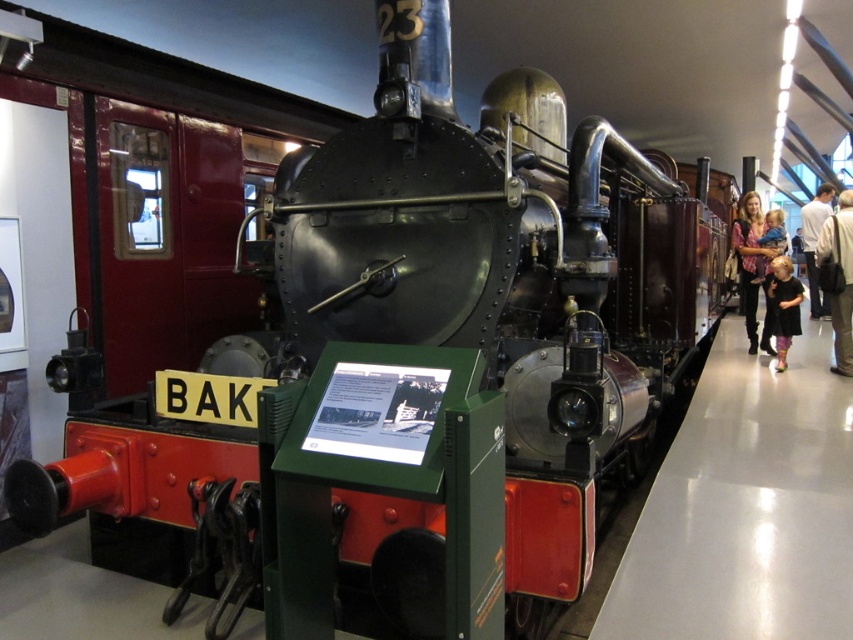
Which is more to the right, black leather jacket at right or light brown leather jacket at right?

Positioned to the right is light brown leather jacket at right.

Does black leather jacket at right appear on the left side of light brown leather jacket at right?

Indeed, black leather jacket at right is positioned on the left side of light brown leather jacket at right.

Where is `black leather jacket at right`? black leather jacket at right is located at coordinates 752,268.

What are the coordinates of `black leather jacket at right` in the screenshot? It's located at (752, 268).

Can you confirm if dark brown leather jacket at right is wider than light pink fabric at right?

No, dark brown leather jacket at right is not wider than light pink fabric at right.

Is the position of dark brown leather jacket at right more distant than that of light pink fabric at right?

No, it is not.

Which is behind, point (816, 262) or point (778, 241)?

The point (778, 241) is behind.

The width and height of the screenshot is (853, 640). I want to click on dark brown leather jacket at right, so click(x=845, y=280).

Does dark brown leather jacket at right appear under black dress at lower right?

Actually, dark brown leather jacket at right is above black dress at lower right.

Between dark brown leather jacket at right and black dress at lower right, which one is positioned lower?

black dress at lower right is below.

I want to click on dark brown leather jacket at right, so click(845, 280).